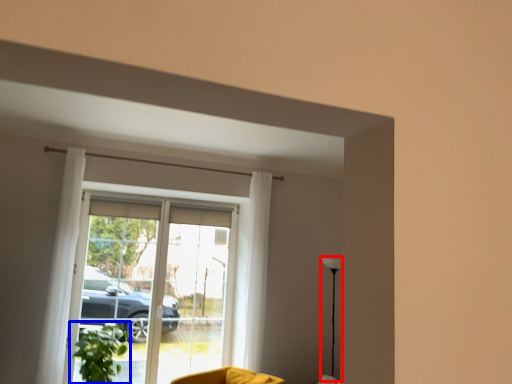
Question: Which point is closer to the camera, lamp (highlighted by a red box) or houseplant (highlighted by a blue box)?

Choices:
 (A) lamp
 (B) houseplant

Answer: (B)